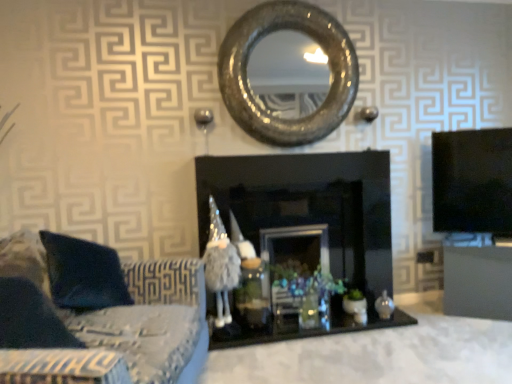
Question: Does shiny metallic mirror at center appear on the right side of black glossy fireplace at center?

Choices:
 (A) yes
 (B) no

Answer: (B)

Question: Is shiny metallic mirror at center beside black glossy fireplace at center?

Choices:
 (A) yes
 (B) no

Answer: (B)

Question: Could you tell me if shiny metallic mirror at center is turned towards black glossy fireplace at center?

Choices:
 (A) yes
 (B) no

Answer: (B)

Question: From the image's perspective, is shiny metallic mirror at center below black glossy fireplace at center?

Choices:
 (A) no
 (B) yes

Answer: (A)

Question: Does shiny metallic mirror at center contain black glossy fireplace at center?

Choices:
 (A) no
 (B) yes

Answer: (A)

Question: Can you confirm if shiny metallic mirror at center is taller than black glossy fireplace at center?

Choices:
 (A) yes
 (B) no

Answer: (B)

Question: Is black glossy fireplace at center directly adjacent to fuzzy fabric wizard at center?

Choices:
 (A) no
 (B) yes

Answer: (A)

Question: Could fuzzy fabric wizard at center be considered to be inside black glossy fireplace at center?

Choices:
 (A) yes
 (B) no

Answer: (A)

Question: Does black glossy fireplace at center appear on the left side of fuzzy fabric wizard at center?

Choices:
 (A) yes
 (B) no

Answer: (B)

Question: Would you consider black glossy fireplace at center to be distant from fuzzy fabric wizard at center?

Choices:
 (A) yes
 (B) no

Answer: (B)

Question: Is black glossy fireplace at center behind fuzzy fabric wizard at center?

Choices:
 (A) yes
 (B) no

Answer: (B)

Question: Does black glossy fireplace at center have a greater height compared to fuzzy fabric wizard at center?

Choices:
 (A) no
 (B) yes

Answer: (B)

Question: Is suede-like fabric couch at lower left oriented away from fuzzy fabric wizard at center?

Choices:
 (A) no
 (B) yes

Answer: (A)